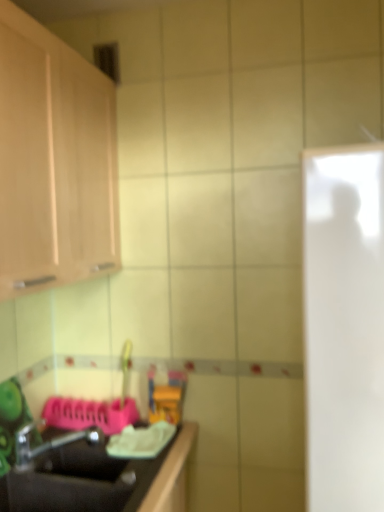
The height and width of the screenshot is (512, 384). I want to click on unoccupied region to the right of metallic silver faucet at lower left, so click(x=133, y=475).